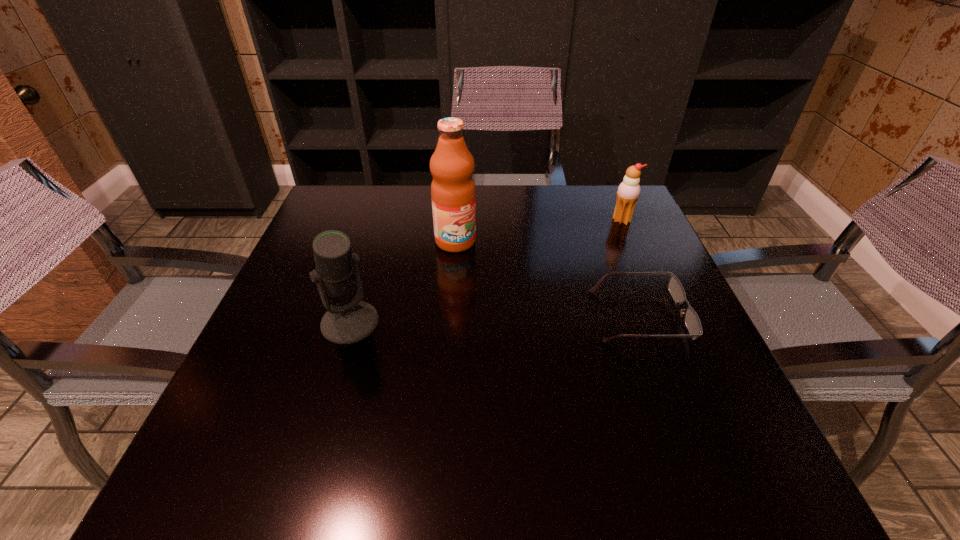
Identify the location of free space located on the front label of the tallest object. (487, 278).

Find the location of `free region located at the front with a straw on the icecream`. free region located at the front with a straw on the icecream is located at coordinates (521, 287).

The image size is (960, 540). What are the coordinates of `free space located 0.190m at the front with a straw on the icecream` in the screenshot? It's located at (571, 253).

Identify the location of vacant position located 0.140m at the front with a straw on the icecream. The width and height of the screenshot is (960, 540). (584, 245).

Image resolution: width=960 pixels, height=540 pixels. In order to click on fruit juice at the far edge in this screenshot , I will do pos(453,193).

At what (x,y) coordinates should I click in order to perform the action: click on icecream that is at the far edge. Please return your answer as a coordinate pair (x, y). This screenshot has height=540, width=960. Looking at the image, I should click on (628, 192).

Where is `object located at the left edge`? Image resolution: width=960 pixels, height=540 pixels. object located at the left edge is located at coordinates (352, 320).

Locate an element on the screen. This screenshot has width=960, height=540. spectacles situated at the right edge is located at coordinates (692, 321).

Identify the location of icecream that is at the right edge. (628, 192).

Identify the location of object at the far right corner. This screenshot has height=540, width=960. (628, 192).